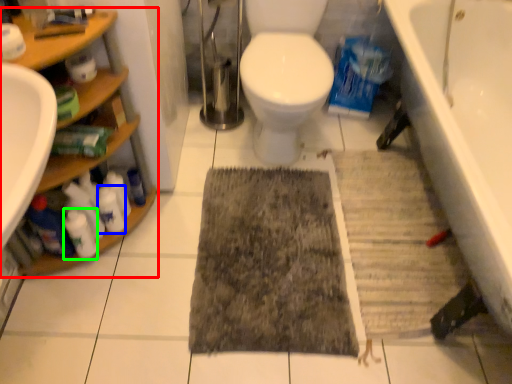
Question: Which object is the closest to the shelf (highlighted by a red box)? Choose among these: cleaning product (highlighted by a blue box) or cleaning product (highlighted by a green box).

Choices:
 (A) cleaning product
 (B) cleaning product

Answer: (A)